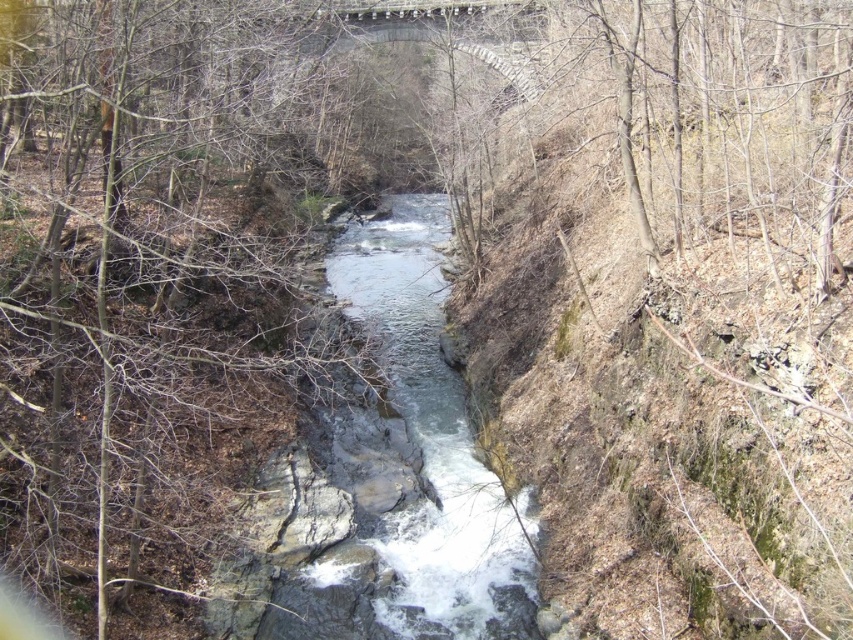
Question: Can you confirm if brown/dry wood at left is wider than clear water at center?

Choices:
 (A) no
 (B) yes

Answer: (B)

Question: Observing the image, what is the correct spatial positioning of brown/dry wood at left in reference to clear water at center?

Choices:
 (A) left
 (B) right

Answer: (A)

Question: Is brown/dry wood at left smaller than clear water at center?

Choices:
 (A) yes
 (B) no

Answer: (A)

Question: Which point is farther from the camera taking this photo?

Choices:
 (A) (148, 532)
 (B) (279, 499)

Answer: (B)

Question: Which object appears farthest from the camera in this image?

Choices:
 (A) brown/dry wood at left
 (B) clear water at center

Answer: (B)

Question: Which of the following is the closest to the observer?

Choices:
 (A) (387, 556)
 (B) (264, 236)

Answer: (A)